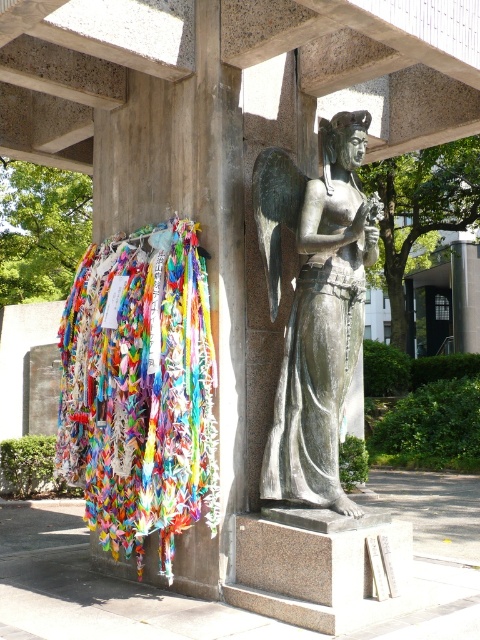
Question: Among these points, which one is farthest from the camera?

Choices:
 (A) (192, 376)
 (B) (312, 180)

Answer: (B)

Question: Is multicolored paper cranes at left smaller than bronze statue at center?

Choices:
 (A) yes
 (B) no

Answer: (B)

Question: Does multicolored paper cranes at left have a smaller size compared to bronze statue at center?

Choices:
 (A) no
 (B) yes

Answer: (A)

Question: Does multicolored paper cranes at left have a greater width compared to bronze statue at center?

Choices:
 (A) yes
 (B) no

Answer: (A)